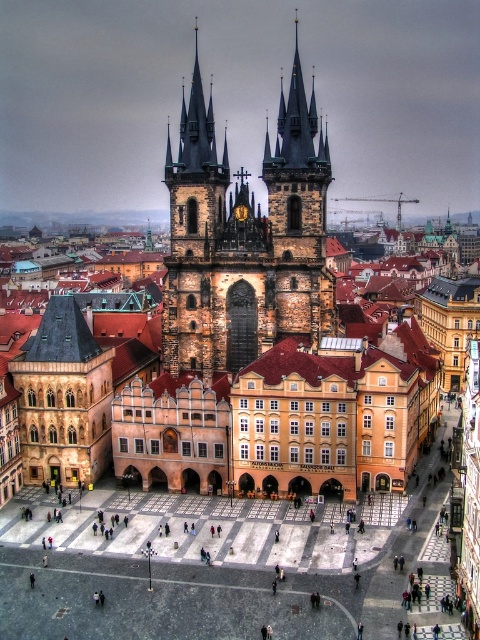
You are a tourist standing in the square and want to take a photo that includes both the dark stone church spires at center and the brown stone tower at center. Which object should you position closer to the top of your camera frame to ensure both are fully visible?

The dark stone church spires at center are taller than the brown stone tower at center, so you should position the dark stone church spires at center closer to the top of your camera frame to ensure both are fully visible.

You are standing in the historic square and want to take a photo of both the dark stone church spires at center and the brown stone tower at center. Which object should you focus on first to ensure both are in the frame?

You should focus on the dark stone church spires at center first since it is closer to you than the brown stone tower at center, ensuring both are in the frame.

You are a tourist in the square and want to take a photo that includes both the dark stone church spires at center and the brown stone tower at center. Which object should you position closer to the camera to ensure both are in the frame?

You should position the dark stone church spires at center closer to the camera because it is bigger than the brown stone tower at center, so it will take up more space in the frame and ensure both are visible.